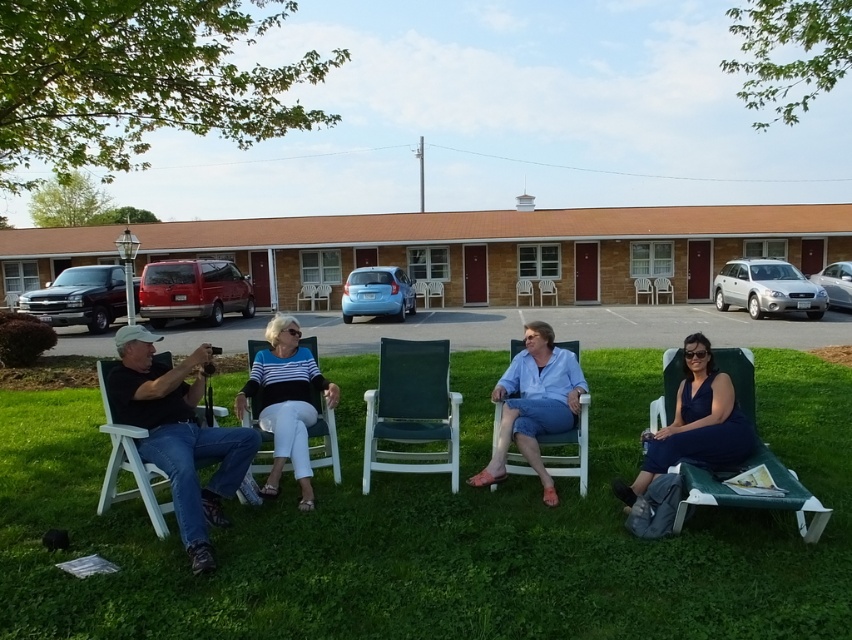
Measure the distance between matte blue dress at lower right and white plastic chair at left.

They are 3.25 meters apart.

Does point (678, 444) come closer to viewer compared to point (102, 380)?

No, it is behind (102, 380).

The height and width of the screenshot is (640, 852). In order to click on matte blue dress at lower right in this screenshot , I will do `click(694, 426)`.

Does green grass at lower center lie behind white plastic chair at center?

No, it is not.

Between point (543, 636) and point (585, 492), which one is positioned behind?

The point (585, 492) is behind.

Does point (366, 557) come in front of point (586, 490)?

Yes, point (366, 557) is closer to viewer.

At what (x,y) coordinates should I click in order to perform the action: click on green grass at lower center. Please return your answer as a coordinate pair (x, y). Looking at the image, I should click on (439, 531).

The image size is (852, 640). What do you see at coordinates (694, 426) in the screenshot?
I see `matte blue dress at lower right` at bounding box center [694, 426].

In order to click on matte blue dress at lower right in this screenshot , I will do `click(694, 426)`.

Is point (691, 388) less distant than point (279, 445)?

No.

The height and width of the screenshot is (640, 852). I want to click on matte blue dress at lower right, so click(x=694, y=426).